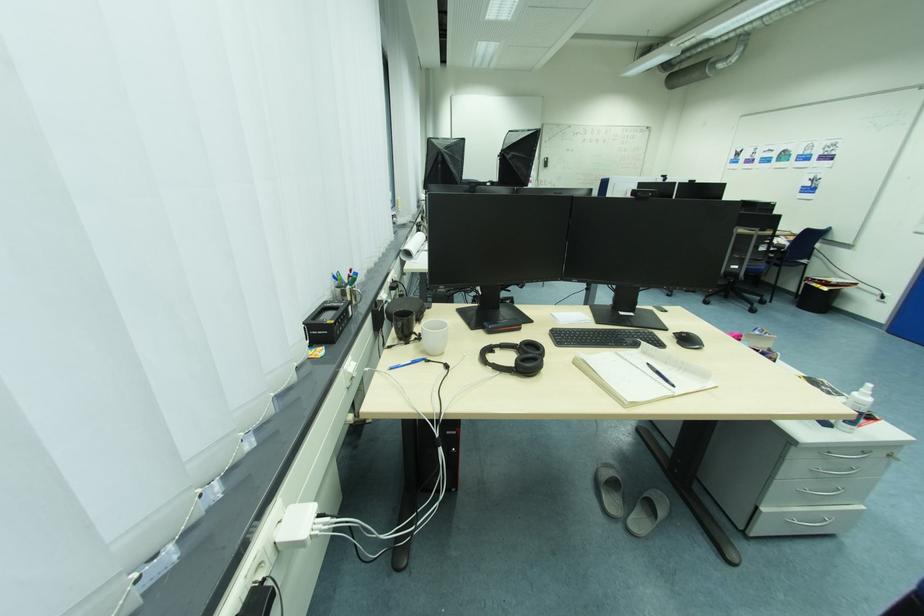
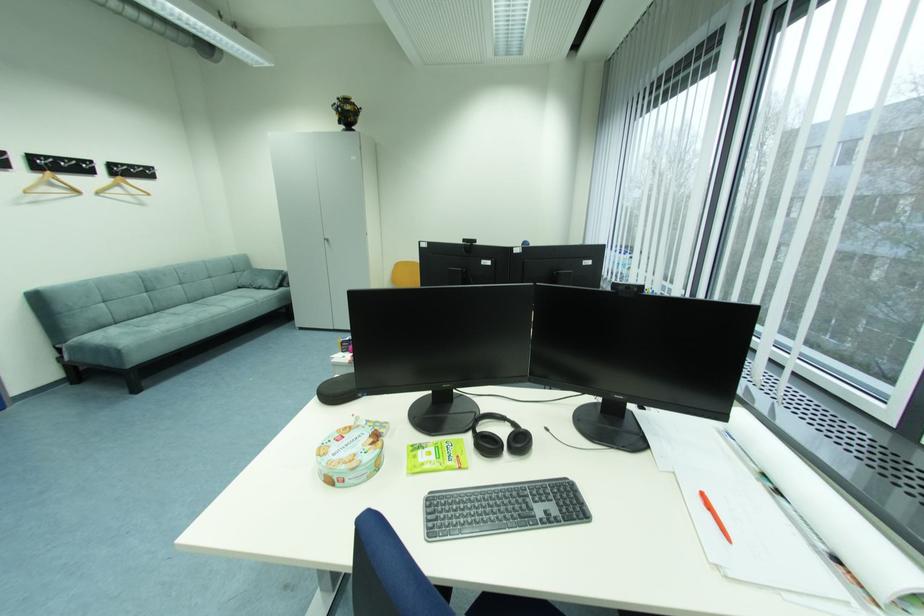
Question: I am providing you with two images of the same scene from different viewpoints. After the viewpoint changes to image2, which objects are now occluded?

Choices:
 (A) glass bottle with cap
 (B) green snack packet
 (C) white spray bottle
 (D) orange pen

Answer: (C)